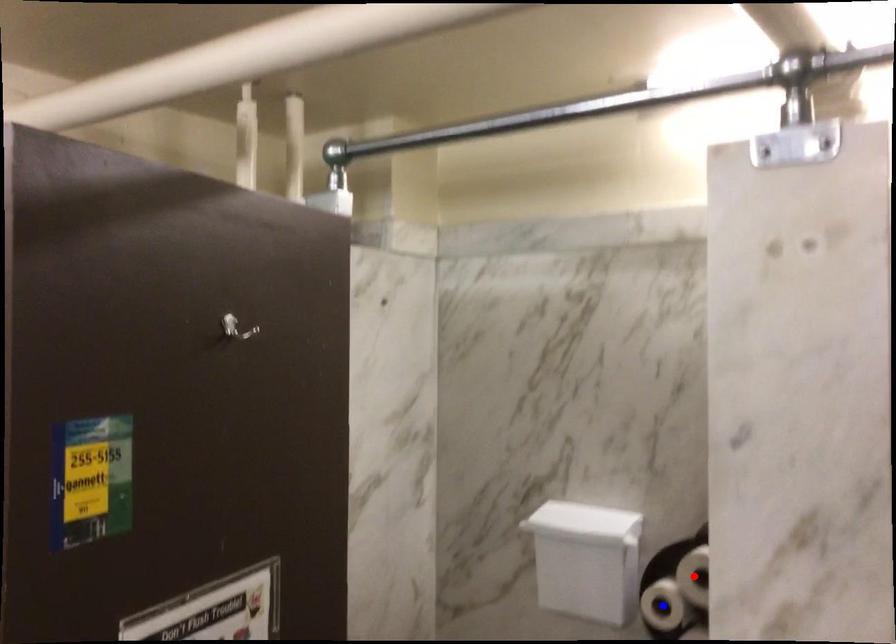
Question: Which of the two points in the image is closer to the camera?

Choices:
 (A) Blue point is closer.
 (B) Red point is closer.

Answer: (A)